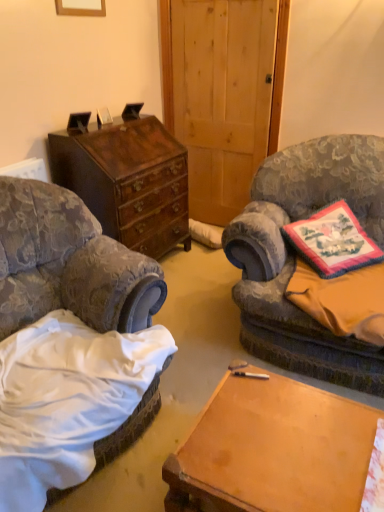
At what (x,y) coordinates should I click in order to perform the action: click on blank space situated above wooden desk at center (from a real-world perspective). Please return your answer as a coordinate pair (x, y). Image resolution: width=384 pixels, height=512 pixels. Looking at the image, I should click on (290, 441).